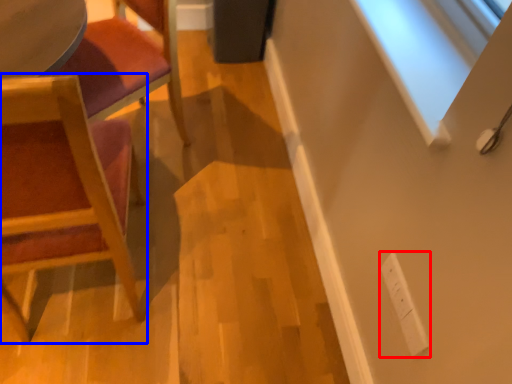
Question: Which object is closer to the camera taking this photo, electric outlet (highlighted by a red box) or chair (highlighted by a blue box)?

Choices:
 (A) electric outlet
 (B) chair

Answer: (B)